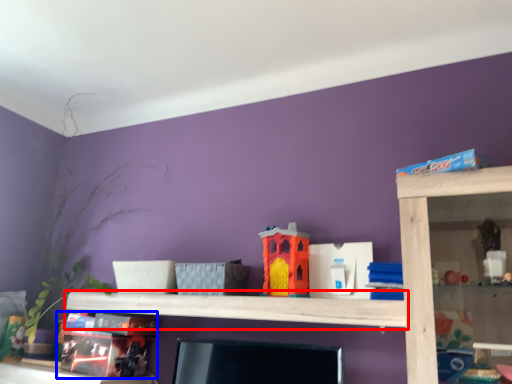
Question: Which object is closer to the camera taking this photo, shelf (highlighted by a red box) or toy (highlighted by a blue box)?

Choices:
 (A) shelf
 (B) toy

Answer: (A)